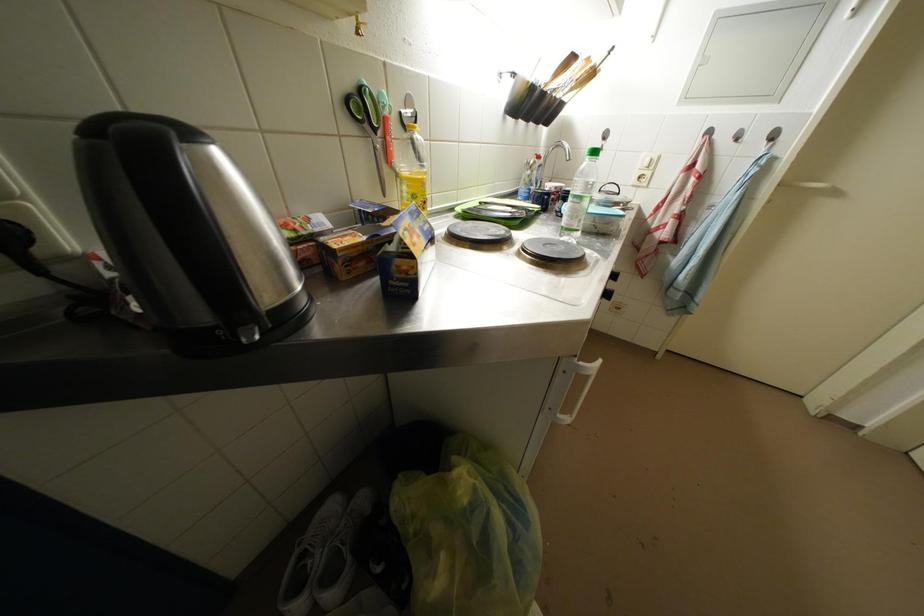
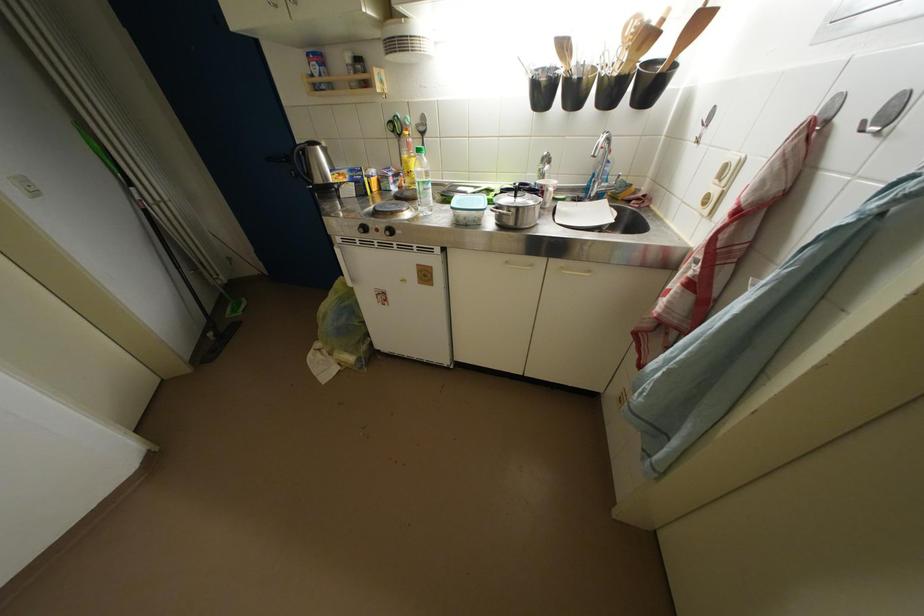
Where in the second image is the point corresponding to [382,135] from the first image?

(407, 140)